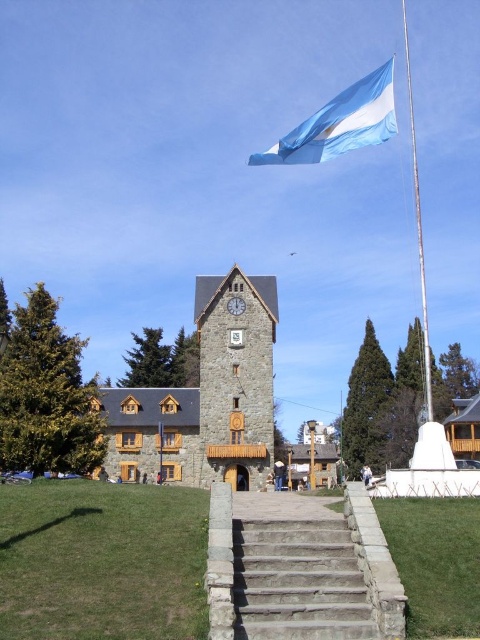
You are a tourist standing at the base of the stone stairs at center, looking up towards the blue fabric flag at upper center. Which object appears narrower from your perspective?

The stone stairs at center appears narrower than the blue fabric flag at upper center from your perspective.

You are a tourist standing at the base of the stone clock tower at center. You notice the blue fabric flag at upper center flying in the wind. Which object occupies more horizontal space in the image?

The blue fabric flag at upper center occupies more horizontal space than the stone clock tower at center, as it has a greater width according to the description.

You are a tourist standing at the base of the stone tower with the clock face. You notice the blue fabric flag at upper center and the white metallic flag pole at upper center. Which object is smaller in size?

The blue fabric flag at upper center is smaller in size compared to the white metallic flag pole at upper center.